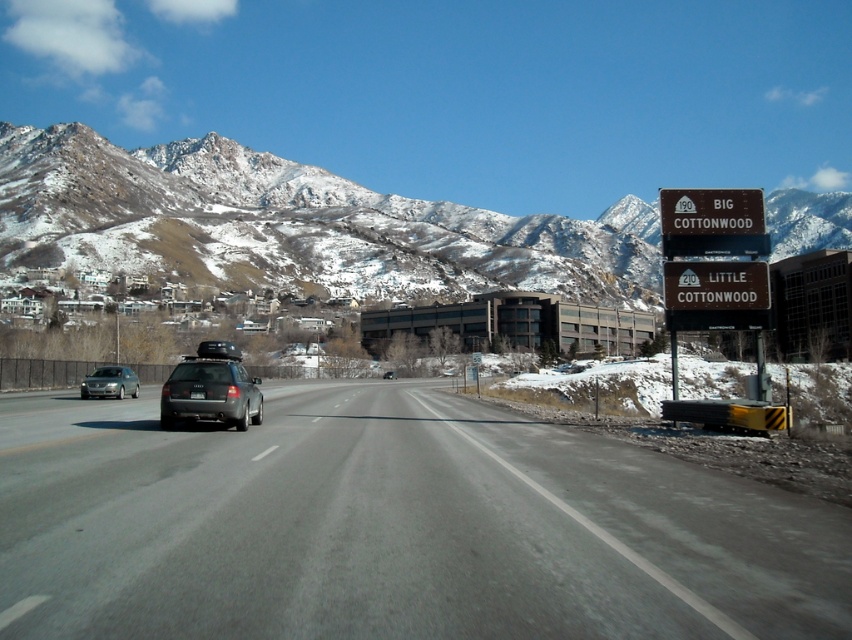
Which is in front, point (68, 196) or point (171, 404)?

Point (171, 404)

You are a GUI agent. You are given a task and a screenshot of the screen. Output one action in this format:
    pyautogui.click(x=<x>, y=<y>)
    Task: Click on the snowy rocky mountain at upper left
    The width and height of the screenshot is (852, 640).
    Given the screenshot: What is the action you would take?
    pyautogui.click(x=296, y=225)

Who is lower down, brown/wooden sign at upper right or satin silver suv at center-left?

satin silver suv at center-left

Identify the location of brown/wooden sign at upper right. (x=715, y=266).

Who is more distant from viewer, (273, 556) or (663, 209)?

Point (663, 209)

Who is lower down, gray asphalt road at center or brown/wooden sign at upper right?

gray asphalt road at center

Describe the element at coordinates (392, 528) in the screenshot. I see `gray asphalt road at center` at that location.

I want to click on gray asphalt road at center, so click(x=392, y=528).